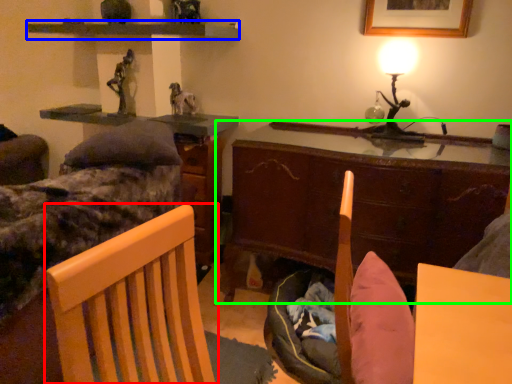
Question: Considering the real-world distances, which object is farthest from chair (highlighted by a red box)? shelf (highlighted by a blue box) or cabinetry (highlighted by a green box)?

Choices:
 (A) shelf
 (B) cabinetry

Answer: (A)